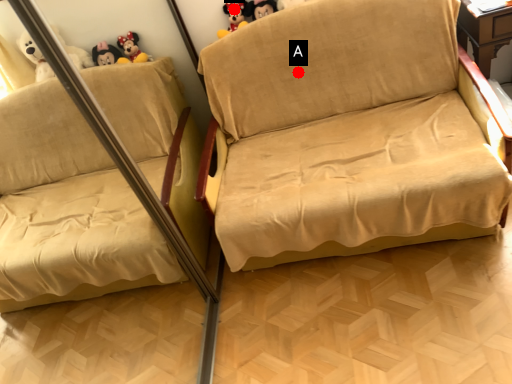
Question: Two points are circled on the image, labeled by A and B beside each circle. Which point is closer to the camera?

Choices:
 (A) A is closer
 (B) B is closer

Answer: (A)